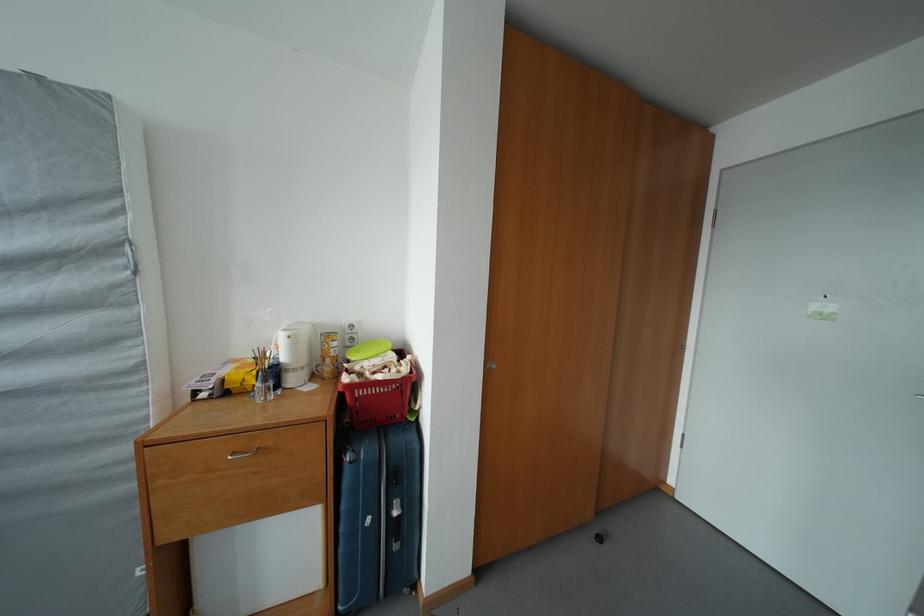
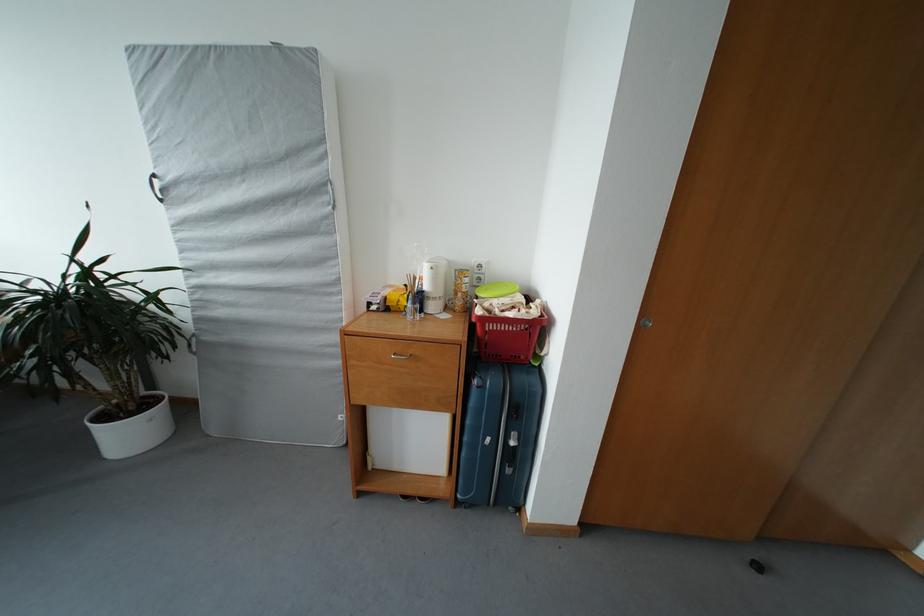
Question: What movement of the cameraman would produce the second image?

Choices:
 (A) Left
 (B) Right
 (C) Forward
 (D) Backward

Answer: (A)